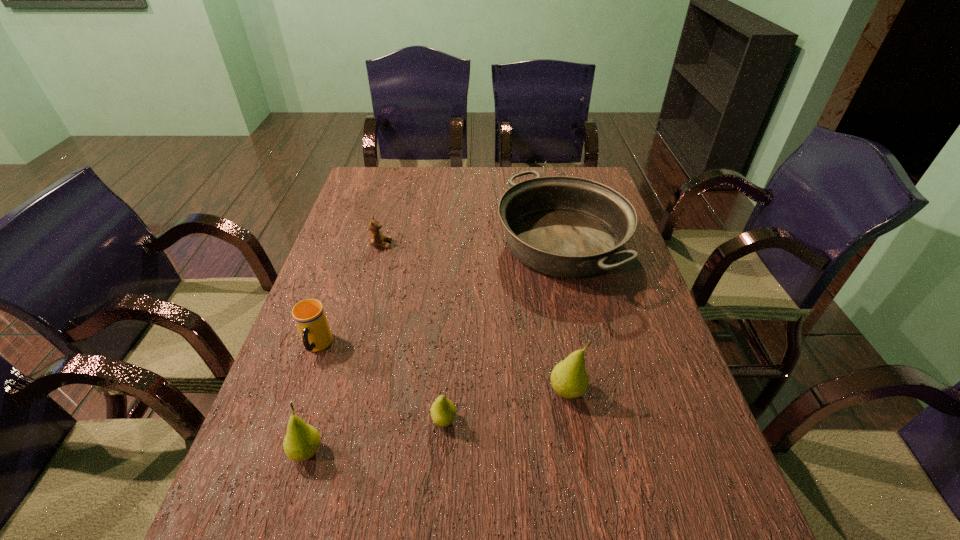
Please point a free position for a pear on the right. Please provide its 2D coordinates. Your answer should be formatted as a tuple, i.e. [(x, y)], where the tuple contains the x and y coordinates of a point satisfying the conditions above.

[(677, 366)]